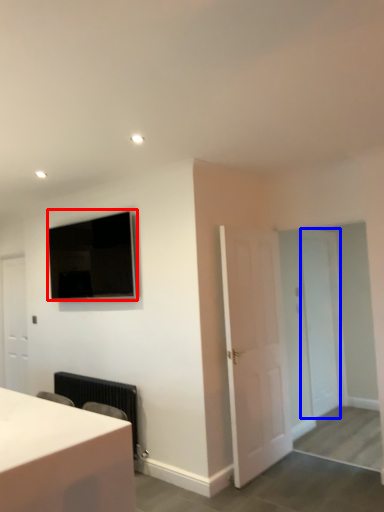
Question: Which object appears farthest to the camera in this image, television (highlighted by a red box) or door (highlighted by a blue box)?

Choices:
 (A) television
 (B) door

Answer: (B)